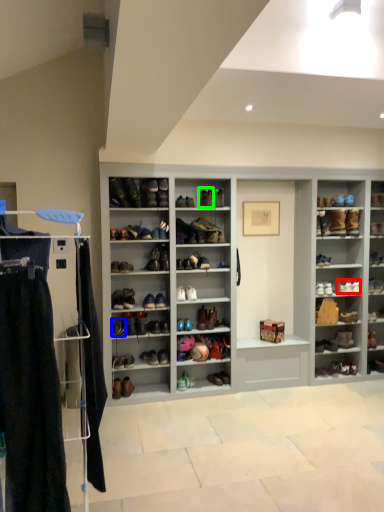
Question: Which object is positioned farthest from shoe (highlighted by a red box)? Select from shoe (highlighted by a blue box) and shoe (highlighted by a green box).

Choices:
 (A) shoe
 (B) shoe

Answer: (A)